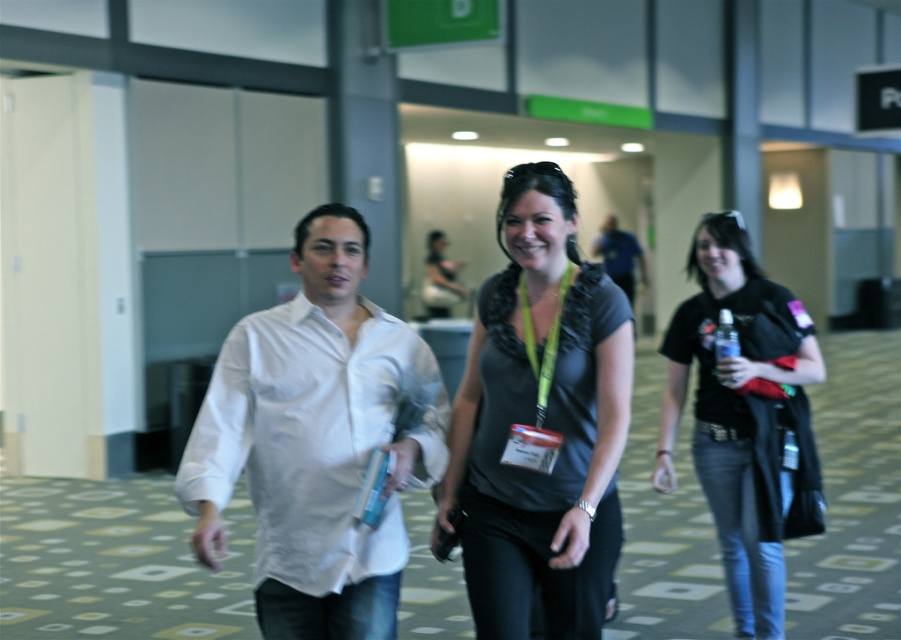
How distant is matte black blouse at center from black matte shirt at right?

matte black blouse at center is 4.86 feet from black matte shirt at right.

Which is above, matte black blouse at center or black matte shirt at right?

black matte shirt at right

Which is behind, point (566, 417) or point (727, 376)?

The point (727, 376) is more distant.

Locate an element on the screen. matte black blouse at center is located at coordinates (540, 424).

Who is positioned more to the left, white cotton shirt at center or matte black blouse at center?

Positioned to the left is white cotton shirt at center.

Consider the image. Between white cotton shirt at center and matte black blouse at center, which one has more height?

matte black blouse at center is taller.

Does point (294, 467) come behind point (462, 538)?

That is False.

The image size is (901, 640). Identify the location of white cotton shirt at center. (317, 440).

This screenshot has height=640, width=901. Describe the element at coordinates (317, 440) in the screenshot. I see `white cotton shirt at center` at that location.

Who is taller, white cotton shirt at center or yellow fabric lanyard at center?

white cotton shirt at center

Between point (217, 433) and point (537, 410), which one is positioned behind?

Positioned behind is point (537, 410).

Locate an element on the screen. white cotton shirt at center is located at coordinates (317, 440).